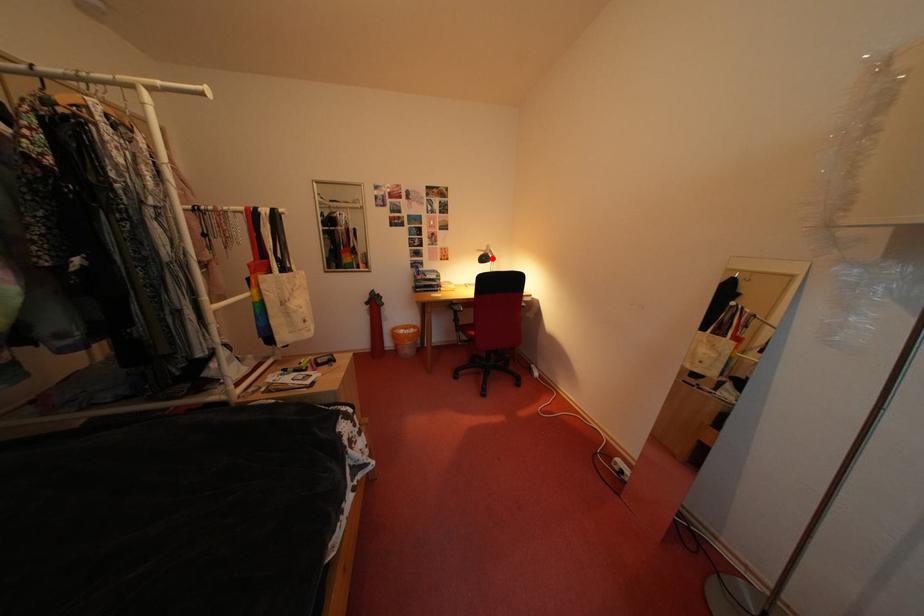
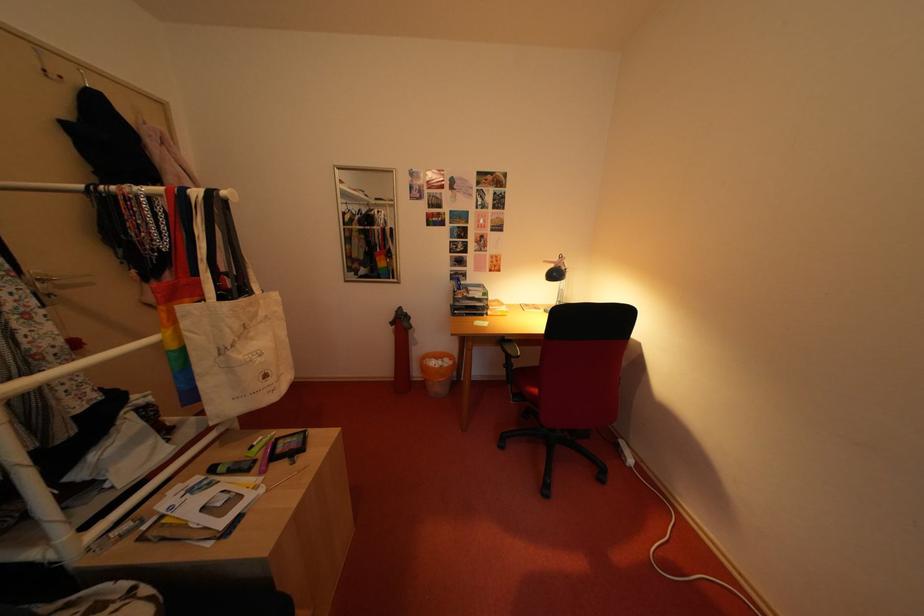
In the second image, find the point that corresponds to the highlighted location in the first image.

(563, 270)